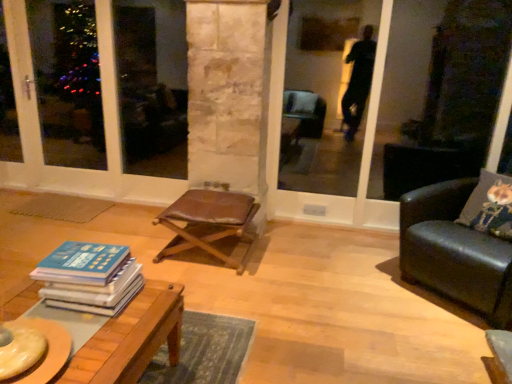
Locate an element on the screen. This screenshot has width=512, height=384. free spot above blue hardcover book at lower left (from a real-world perspective) is located at coordinates pos(85,257).